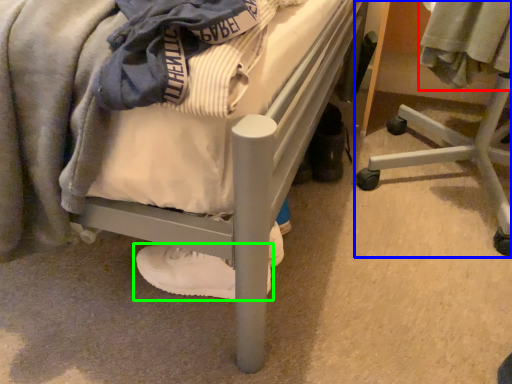
Question: Considering the real-world distances, which object is closest to clothing (highlighted by a red box)? furniture (highlighted by a blue box) or footwear (highlighted by a green box).

Choices:
 (A) furniture
 (B) footwear

Answer: (A)